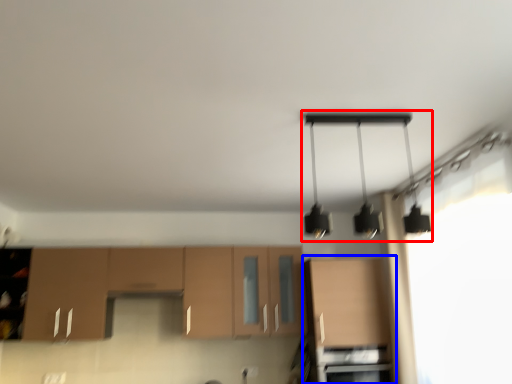
Question: Among these objects, which one is nearest to the camera, lamp (highlighted by a red box) or cabinetry (highlighted by a blue box)?

Choices:
 (A) lamp
 (B) cabinetry

Answer: (A)